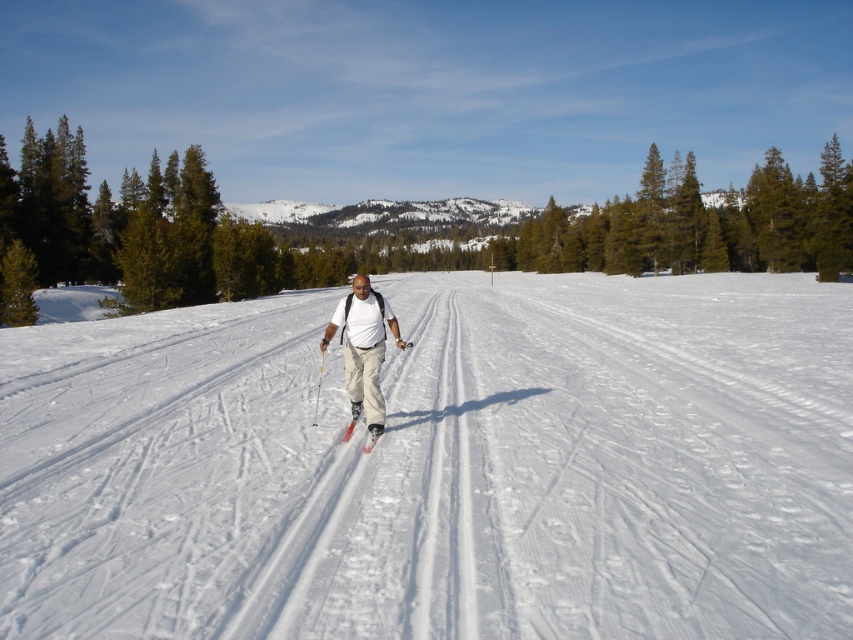
Question: Is white snow at center behind matte white shirt at center?

Choices:
 (A) yes
 (B) no

Answer: (B)

Question: Which point is farther to the camera?

Choices:
 (A) matte white shirt at center
 (B) white snow at center

Answer: (A)

Question: Which point is farther to the camera?

Choices:
 (A) (360, 320)
 (B) (752, 465)

Answer: (A)

Question: Can you confirm if white snow at center is positioned to the left of white matte ski at center?

Choices:
 (A) yes
 (B) no

Answer: (B)

Question: In this image, where is white snow at center located relative to white matte ski at center?

Choices:
 (A) right
 (B) left

Answer: (A)

Question: Which point is farther to the camera?

Choices:
 (A) white matte ski at center
 (B) white snow at center
 (C) matte white shirt at center

Answer: (C)